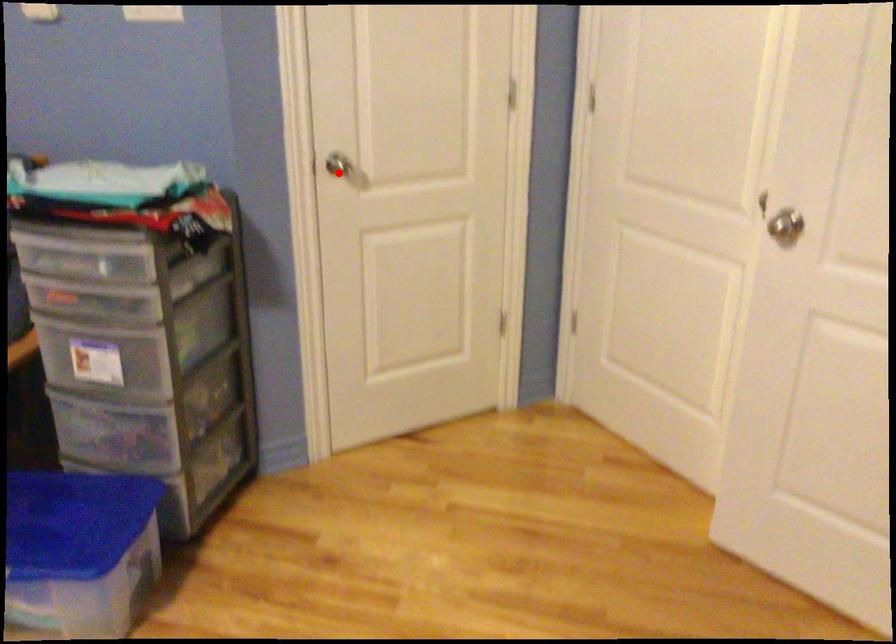
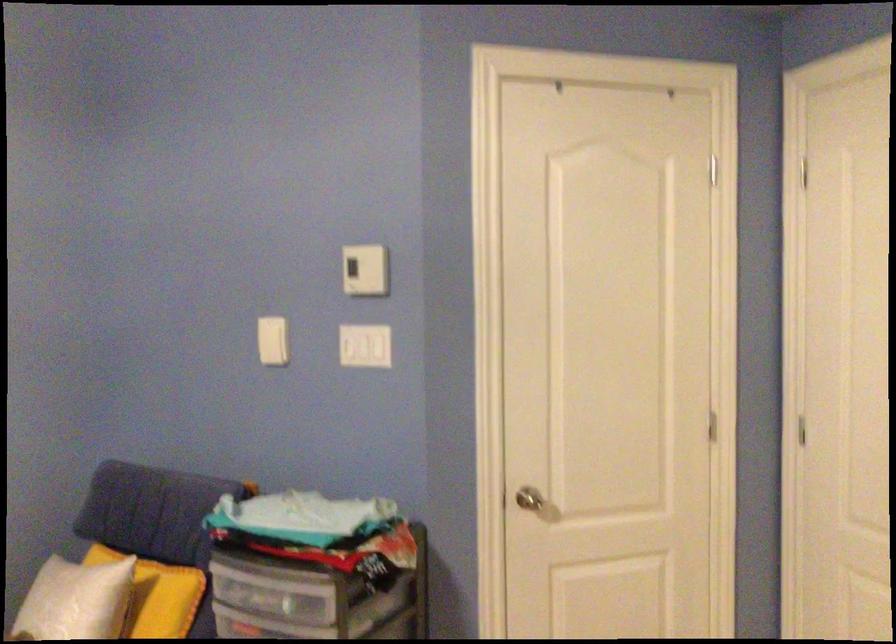
Where in the second image is the point corresponding to the highlighted location from the first image?

(531, 502)